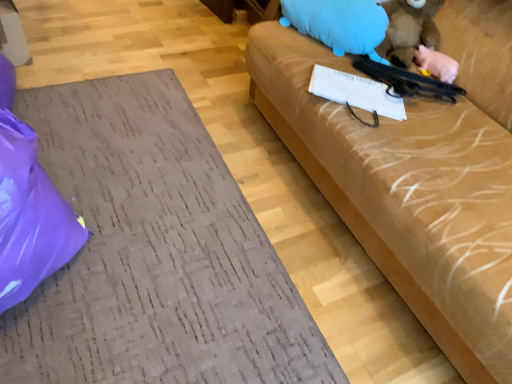
Locate an element on the screen. The width and height of the screenshot is (512, 384). free space behind purple plastic bag at lower left is located at coordinates point(105,154).